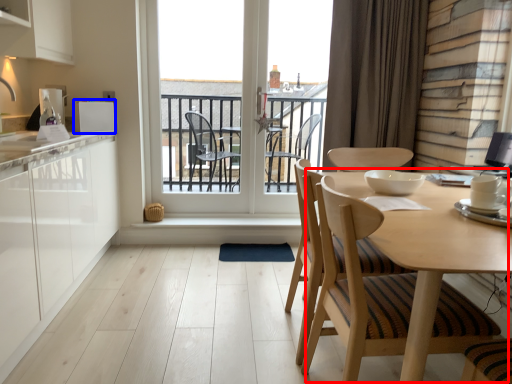
Question: Which object appears farthest to the camera in this image, round table (highlighted by a red box) or appliance (highlighted by a blue box)?

Choices:
 (A) round table
 (B) appliance

Answer: (B)